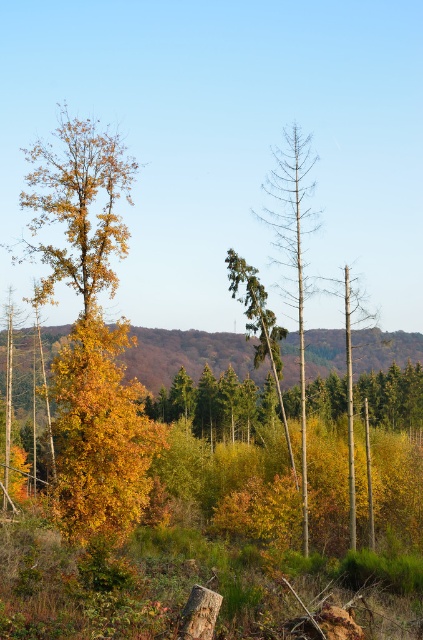
Can you confirm if autumn foliage at center is positioned below bare wood tree at center?

Yes.

Does autumn foliage at center appear on the right side of bare wood tree at center?

In fact, autumn foliage at center is to the left of bare wood tree at center.

What do you see at coordinates (186, 355) in the screenshot?
I see `autumn foliage at center` at bounding box center [186, 355].

Image resolution: width=423 pixels, height=640 pixels. In order to click on autumn foliage at center in this screenshot , I will do `click(186, 355)`.

Can you confirm if golden wood tree at left is positioned to the right of autumn foliage at center?

Incorrect, golden wood tree at left is not on the right side of autumn foliage at center.

The image size is (423, 640). I want to click on golden wood tree at left, so tap(90, 333).

Between golden wood tree at left and smooth brown tree trunk at center, which one has more height?

With more height is golden wood tree at left.

This screenshot has width=423, height=640. What do you see at coordinates (90, 333) in the screenshot? I see `golden wood tree at left` at bounding box center [90, 333].

You are a GUI agent. You are given a task and a screenshot of the screen. Output one action in this format:
    pyautogui.click(x=<x>, y=<y>)
    Task: Click on the golden wood tree at left
    The image size is (423, 640).
    Given the screenshot: What is the action you would take?
    pos(90,333)